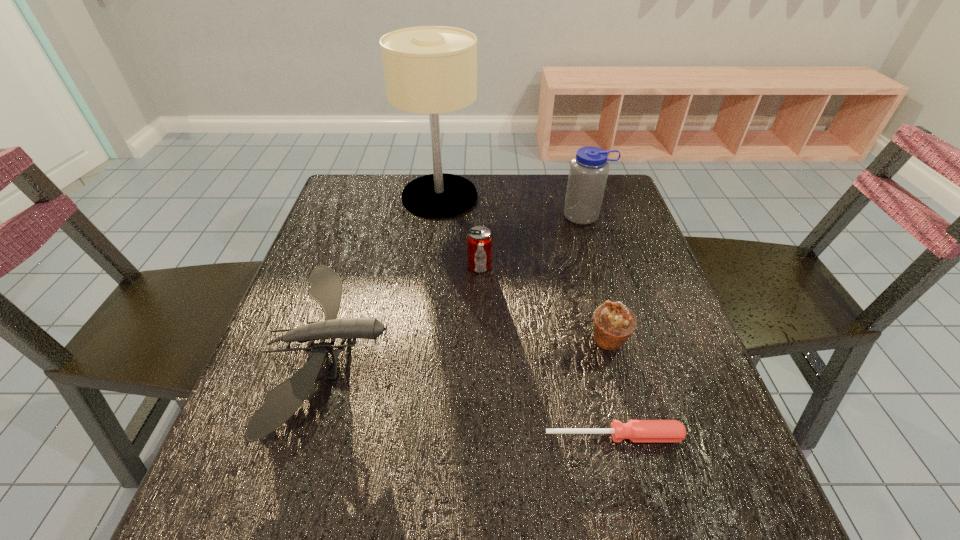
Find the location of a particular element. free space between the fourth nearest object and the tallest object is located at coordinates (460, 231).

Where is `vacant area that lies between the muffin and the shortest object`? vacant area that lies between the muffin and the shortest object is located at coordinates pos(612,388).

Choose which object is the fourth nearest neighbor to the drone. Please provide its 2D coordinates. Your answer should be formatted as a tuple, i.e. [(x, y)], where the tuple contains the x and y coordinates of a point satisfying the conditions above.

[(613, 324)]

Locate which object ranks fourth in proximity to the water bottle. Please provide its 2D coordinates. Your answer should be formatted as a tuple, i.e. [(x, y)], where the tuple contains the x and y coordinates of a point satisfying the conditions above.

[(285, 399)]

In order to click on free space that satisfies the following two spatial constraints: 1. at the head of the shortest object; 2. on the right side of the drone in this screenshot , I will do `click(301, 436)`.

I want to click on blank space that satisfies the following two spatial constraints: 1. at the head of the shortest object; 2. on the left side of the second shortest object, so click(x=301, y=436).

Find the location of a particular element. This screenshot has height=540, width=960. vacant point that satisfies the following two spatial constraints: 1. on the front side of the third farthest object; 2. on the left side of the tallest object is located at coordinates (431, 266).

Find the location of `vacant region that satisfies the following two spatial constraints: 1. at the head of the drone; 2. on the right side of the screwdriver`. vacant region that satisfies the following two spatial constraints: 1. at the head of the drone; 2. on the right side of the screwdriver is located at coordinates (301, 436).